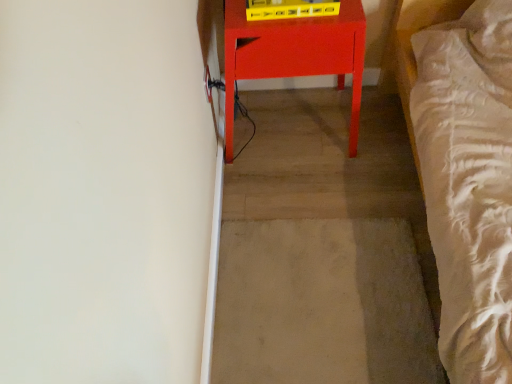
Where is `blank space situated above beige carpet at center (from a real-world perspective)`? blank space situated above beige carpet at center (from a real-world perspective) is located at coordinates (331, 294).